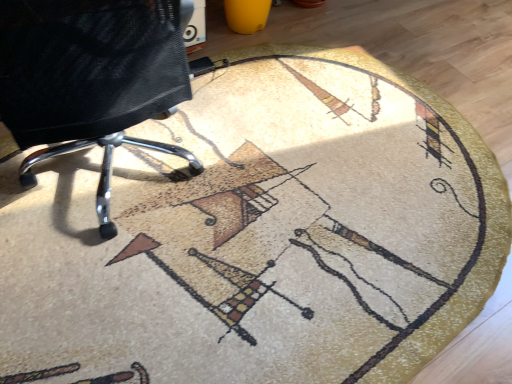
Measure the distance between point (135, 53) and camera.

The depth of point (135, 53) is 3.38 feet.

At what (x,y) coordinates should I click in order to perform the action: click on black mesh chair at left. Please return your answer as a coordinate pair (x, y). This screenshot has height=384, width=512. Looking at the image, I should click on (91, 81).

This screenshot has height=384, width=512. Describe the element at coordinates (91, 81) in the screenshot. I see `black mesh chair at left` at that location.

Image resolution: width=512 pixels, height=384 pixels. What are the coordinates of `black mesh chair at left` in the screenshot? It's located at (91, 81).